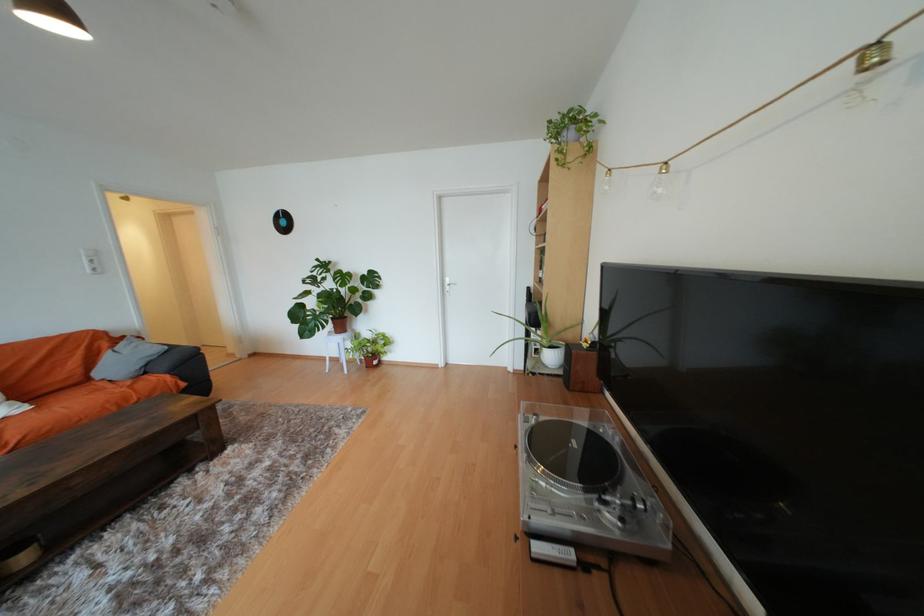
Describe the element at coordinates (103, 395) in the screenshot. I see `a orange sofa surface` at that location.